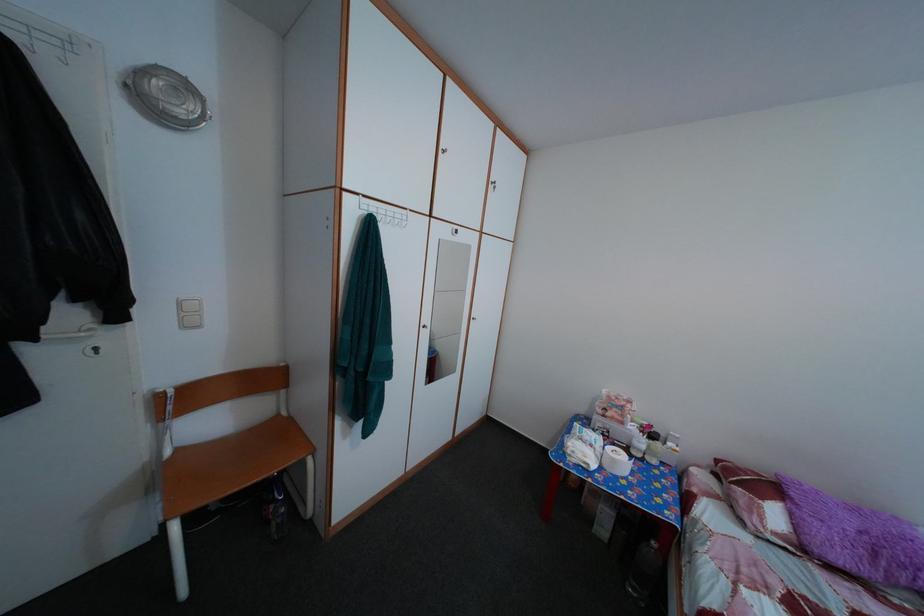
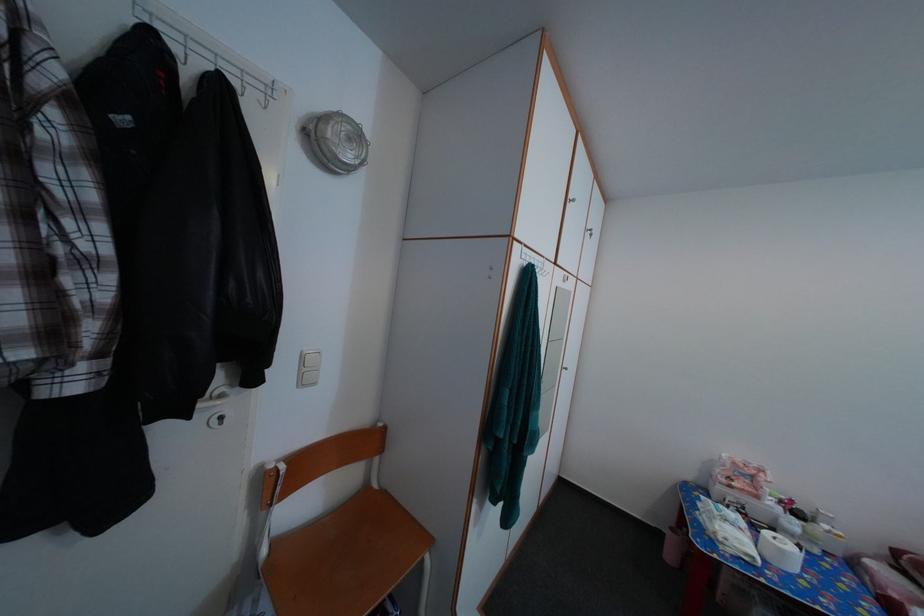
Locate, in the second image, the point that corresponds to point (188, 456) in the first image.

(282, 552)